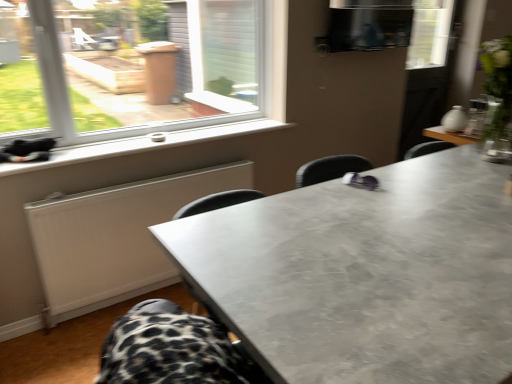
At what (x,y) coordinates should I click in order to perform the action: click on white plastic window sill at lower left. Please return your answer as a coordinate pair (x, y). The height and width of the screenshot is (384, 512). Looking at the image, I should click on (143, 144).

Is white matte radiator at lower left not inside white plastic window sill at lower left?

Yes, white matte radiator at lower left is outside of white plastic window sill at lower left.

From a real-world perspective, is white matte radiator at lower left physically below white plastic window sill at lower left?

Yes.

From the picture: Does white matte radiator at lower left turn towards white plastic window sill at lower left?

No, white matte radiator at lower left is not turned towards white plastic window sill at lower left.

Considering the sizes of white matte radiator at lower left and white plastic window sill at lower left in the image, is white matte radiator at lower left bigger or smaller than white plastic window sill at lower left?

Clearly, white matte radiator at lower left is larger in size than white plastic window sill at lower left.

Is matte gray table at center in front of or behind white matte radiator at lower left in the image?

A: matte gray table at center is positioned closer to the viewer than white matte radiator at lower left.

Can you confirm if matte gray table at center is wider than white matte radiator at lower left?

Yes.

From a real-world perspective, between matte gray table at center and white matte radiator at lower left, who is vertically lower?

white matte radiator at lower left.

Which object is positioned more to the right, matte gray table at center or white matte radiator at lower left?

From the viewer's perspective, matte gray table at center appears more on the right side.

From the picture: Is white matte radiator at lower left bigger than matte gray table at center?

Actually, white matte radiator at lower left might be smaller than matte gray table at center.

From a real-world perspective, who is located lower, white matte radiator at lower left or matte gray table at center?

white matte radiator at lower left, from a real-world perspective.

How many degrees apart are the facing directions of white plastic window sill at lower left and white matte radiator at lower left?

The angle between the facing direction of white plastic window sill at lower left and the facing direction of white matte radiator at lower left is 0.256 degrees.

Does point (64, 160) come farther from viewer compared to point (112, 191)?

That is False.

The height and width of the screenshot is (384, 512). I want to click on radiator below the white plastic window sill at lower left (from a real-world perspective), so click(115, 237).

Measure the distance between white plastic window sill at lower left and white matte radiator at lower left.

white plastic window sill at lower left and white matte radiator at lower left are 16.33 inches apart from each other.

From a real-world perspective, which object stands above the other?

white plastic window sill at lower left, from a real-world perspective.

From the image's perspective, is white plastic window sill at lower left located above matte gray table at center?

Yes, from the image's perspective, white plastic window sill at lower left is over matte gray table at center.

Does white plastic window sill at lower left touch matte gray table at center?

white plastic window sill at lower left is not next to matte gray table at center, and they're not touching.

Considering the sizes of white plastic window sill at lower left and matte gray table at center in the image, is white plastic window sill at lower left taller or shorter than matte gray table at center?

In the image, white plastic window sill at lower left appears to be shorter than matte gray table at center.

Is white plastic window sill at lower left completely or partially inside matte gray table at center?

No, white plastic window sill at lower left is located outside of matte gray table at center.

Does point (466, 160) appear closer or farther from the camera than point (234, 129)?

Point (466, 160) is positioned closer to the camera compared to point (234, 129).

Could you tell me if matte gray table at center is turned towards white plastic window sill at lower left?

Yes.

How different are the orientations of matte gray table at center and white plastic window sill at lower left in degrees?

The angle between the facing direction of matte gray table at center and the facing direction of white plastic window sill at lower left is 180 degrees.

What are the coordinates of `radiator behind the white plastic window sill at lower left` in the screenshot? It's located at (115, 237).

This screenshot has height=384, width=512. In order to click on table on the right of the white matte radiator at lower left in this screenshot , I will do `click(365, 275)`.

Estimate the real-world distances between objects in this image. Which object is closer to white matte radiator at lower left, matte gray table at center or white plastic window sill at lower left?

Among the two, white plastic window sill at lower left is located nearer to white matte radiator at lower left.

Based on their spatial positions, is white matte radiator at lower left or white plastic window sill at lower left further from matte gray table at center?

white plastic window sill at lower left is positioned further to the anchor matte gray table at center.

Considering their positions, is white plastic window sill at lower left positioned further to white matte radiator at lower left than matte gray table at center?

matte gray table at center is positioned further to the anchor white matte radiator at lower left.

Based on their spatial positions, is white matte radiator at lower left or matte gray table at center closer to white plastic window sill at lower left?

Based on the image, white matte radiator at lower left appears to be nearer to white plastic window sill at lower left.

Looking at the image, which one is located further to matte gray table at center, white plastic window sill at lower left or white matte radiator at lower left?

The object further to matte gray table at center is white plastic window sill at lower left.

When comparing their distances from white plastic window sill at lower left, does matte gray table at center or white matte radiator at lower left seem further?

Based on the image, matte gray table at center appears to be further to white plastic window sill at lower left.

At what (x,y) coordinates should I click in order to perform the action: click on window sill between matte gray table at center and white matte radiator at lower left from front to back. Please return your answer as a coordinate pair (x, y). This screenshot has height=384, width=512. Looking at the image, I should click on (143, 144).